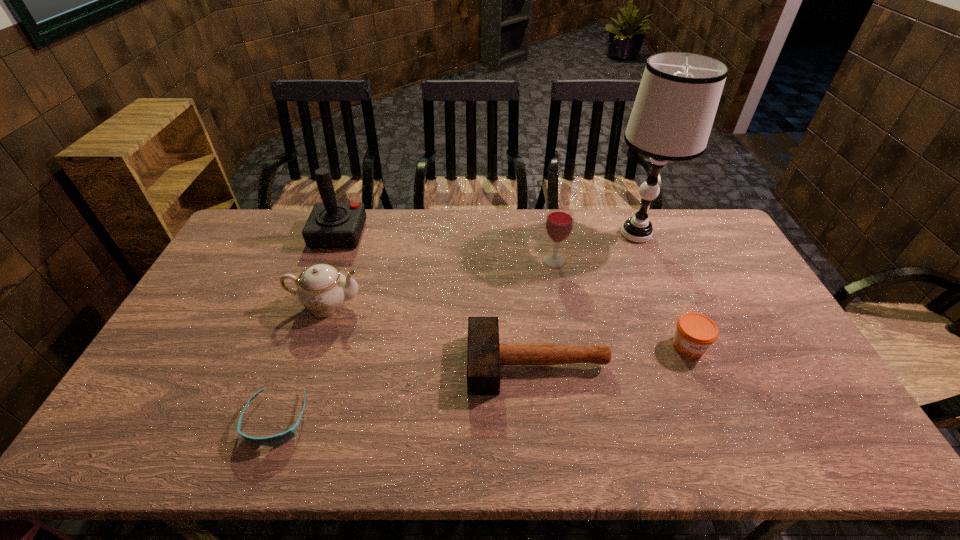
The image size is (960, 540). I want to click on vacant region located 0.150m on the left of the wineglass, so click(x=497, y=261).

At what (x,y) coordinates should I click in order to perform the action: click on vacant space located 0.360m at the spout of the fourth nearest object. Please return your answer as a coordinate pair (x, y). This screenshot has height=540, width=960. Looking at the image, I should click on (480, 304).

Locate an element on the screen. This screenshot has width=960, height=540. free space located 0.230m on the front label of the jam is located at coordinates (729, 442).

Identify the location of free point located 0.050m on the hammer head face of the mallet. The width and height of the screenshot is (960, 540). (450, 363).

In order to click on free space located on the hammer head face of the mallet in this screenshot , I will do `click(450, 363)`.

At what (x,y) coordinates should I click in order to perform the action: click on vacant region located 0.370m on the hammer head face of the mallet. Please return your answer as a coordinate pair (x, y). The image size is (960, 540). Looking at the image, I should click on (332, 363).

Locate an element on the screen. The height and width of the screenshot is (540, 960). table lamp that is positioned at the far edge is located at coordinates (673, 113).

Where is `joystick positioned at the far edge`? This screenshot has height=540, width=960. joystick positioned at the far edge is located at coordinates (331, 224).

Locate an element on the screen. This screenshot has width=960, height=540. object that is at the near edge is located at coordinates (275, 440).

In the image, there is a desktop. Where is `vacant space at the far edge`? The image size is (960, 540). vacant space at the far edge is located at coordinates (405, 245).